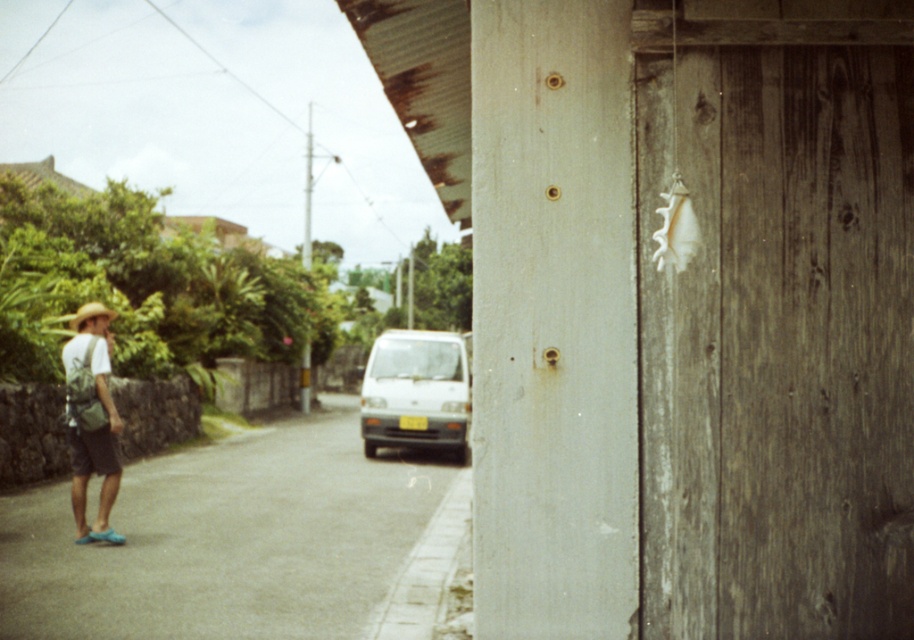
You are standing on the street and see two points marked in the image. Which point is nearer to you, point (342, 540) or point (462, 404)?

Point (342, 540) is closer to the viewer than point (462, 404).

You are a pedestrian standing on the gray asphalt pavement at lower left and want to reach the white matte van at center. Which direction should you walk to get there?

Since the gray asphalt pavement at lower left is to the left of the white matte van at center, you should walk to the right to reach the van.